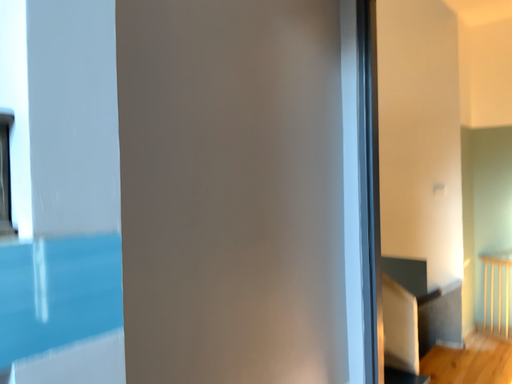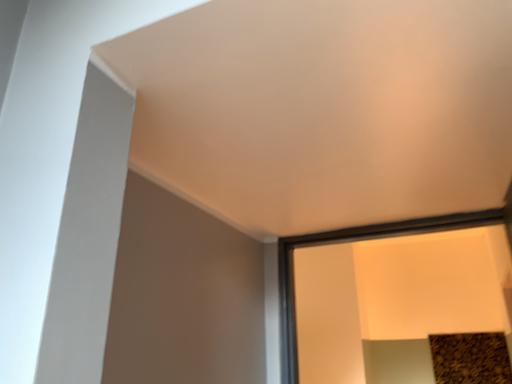
Question: How did the camera likely rotate when shooting the video?

Choices:
 (A) rotated right
 (B) rotated left

Answer: (A)